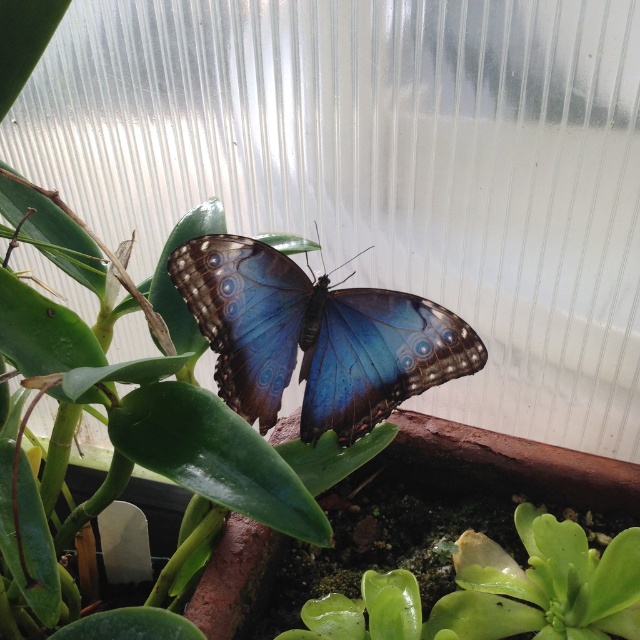
In the scene shown: Who is more forward, (264, 365) or (592, 637)?

Point (592, 637)

The width and height of the screenshot is (640, 640). Identify the location of shiny blue butterfly at center. (314, 337).

Find the location of a particular element. The image size is (640, 640). shiny blue butterfly at center is located at coordinates (314, 337).